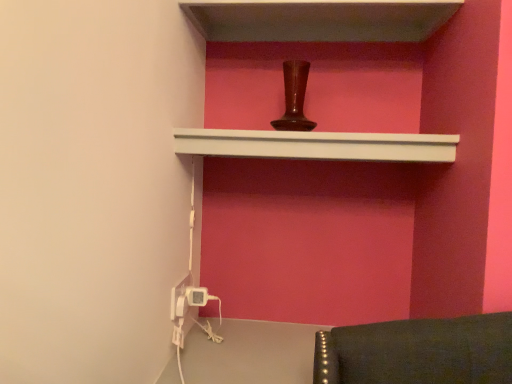
Question: From a real-world perspective, is white plastic electric outlet at lower left, arranged as the second electric outlet when viewed from the left, located higher than smooth white shelf at upper center, which ranks as the 1th shelf in top-to-bottom order?

Choices:
 (A) yes
 (B) no

Answer: (B)

Question: From a real-world perspective, is white plastic electric outlet at lower left, arranged as the second electric outlet when viewed from the left, positioned under smooth white shelf at upper center, which is counted as the second shelf, starting from the bottom, based on gravity?

Choices:
 (A) yes
 (B) no

Answer: (A)

Question: Does white plastic electric outlet at lower left, arranged as the first electric outlet when viewed from the right, have a greater width compared to smooth white shelf at upper center, which is counted as the second shelf, starting from the bottom?

Choices:
 (A) yes
 (B) no

Answer: (B)

Question: From the image's perspective, does white plastic electric outlet at lower left, arranged as the first electric outlet when viewed from the right, appear higher than smooth white shelf at upper center, which is counted as the second shelf, starting from the bottom?

Choices:
 (A) yes
 (B) no

Answer: (B)

Question: Does white plastic electric outlet at lower left, arranged as the second electric outlet when viewed from the left, have a greater height compared to smooth white shelf at upper center, which is counted as the second shelf, starting from the bottom?

Choices:
 (A) yes
 (B) no

Answer: (B)

Question: From their relative heights in the image, would you say white matte shelf at upper center, acting as the 1th shelf starting from the bottom, is taller or shorter than smooth white shelf at upper center, which is counted as the second shelf, starting from the bottom?

Choices:
 (A) tall
 (B) short

Answer: (A)

Question: Looking at the image, does white matte shelf at upper center, acting as the 1th shelf starting from the bottom, seem bigger or smaller compared to smooth white shelf at upper center, which is counted as the second shelf, starting from the bottom?

Choices:
 (A) small
 (B) big

Answer: (A)

Question: Is point (231, 144) positioned closer to the camera than point (309, 1)?

Choices:
 (A) farther
 (B) closer

Answer: (A)

Question: Considering the relative positions of white matte shelf at upper center, acting as the 1th shelf starting from the bottom, and smooth white shelf at upper center, which is counted as the second shelf, starting from the bottom, in the image provided, is white matte shelf at upper center, acting as the 1th shelf starting from the bottom, to the left or to the right of smooth white shelf at upper center, which is counted as the second shelf, starting from the bottom,?

Choices:
 (A) left
 (B) right

Answer: (A)

Question: Is white plastic electric outlet at lower left, arranged as the second electric outlet when viewed from the left, bigger or smaller than white plastic electric outlet at lower left, which is the second electric outlet from right to left?

Choices:
 (A) big
 (B) small

Answer: (A)

Question: From a real-world perspective, is white plastic electric outlet at lower left, arranged as the first electric outlet when viewed from the right, physically located above or below white plastic electric outlet at lower left, which is the first electric outlet in left-to-right order?

Choices:
 (A) above
 (B) below

Answer: (B)

Question: Considering the positions of white plastic electric outlet at lower left, arranged as the first electric outlet when viewed from the right, and white plastic electric outlet at lower left, which is the second electric outlet from right to left, in the image, is white plastic electric outlet at lower left, arranged as the first electric outlet when viewed from the right, taller or shorter than white plastic electric outlet at lower left, which is the second electric outlet from right to left,?

Choices:
 (A) short
 (B) tall

Answer: (A)

Question: In the image, is white plastic electric outlet at lower left, arranged as the first electric outlet when viewed from the right, on the left side or the right side of white plastic electric outlet at lower left, which is the second electric outlet from right to left?

Choices:
 (A) left
 (B) right

Answer: (B)

Question: Is smooth white shelf at upper center, which is counted as the second shelf, starting from the bottom, in front of or behind white plastic electric outlet at lower left, arranged as the first electric outlet when viewed from the right, in the image?

Choices:
 (A) behind
 (B) front

Answer: (B)

Question: Is smooth white shelf at upper center, which ranks as the 1th shelf in top-to-bottom order, taller or shorter than white plastic electric outlet at lower left, arranged as the second electric outlet when viewed from the left?

Choices:
 (A) tall
 (B) short

Answer: (A)